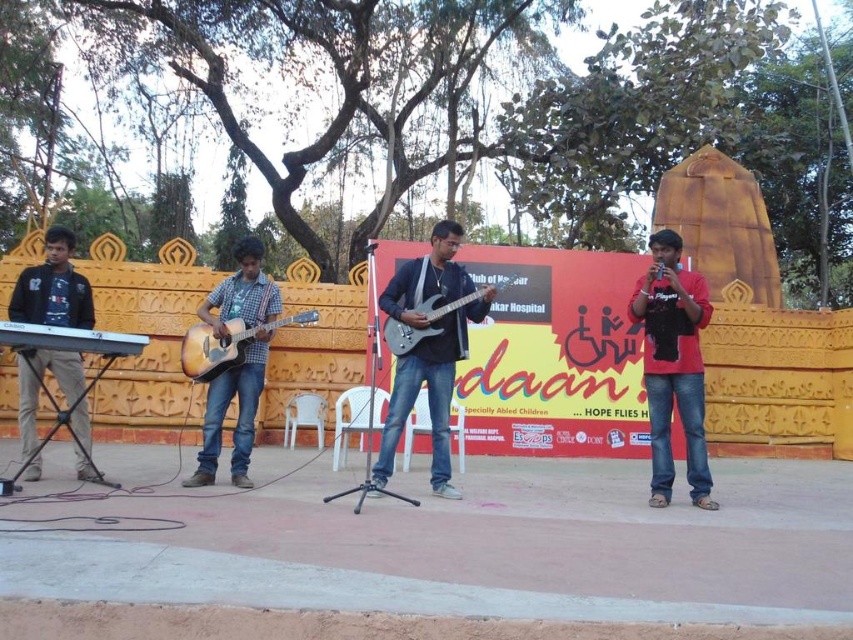
Question: Among these objects, which one is nearest to the camera?

Choices:
 (A) metallic silver guitar at center
 (B) natural wood acoustic guitar at center
 (C) red matte shirt at right

Answer: (A)

Question: Is wooden acoustic guitar at center positioned behind glossy electric guitar at center?

Choices:
 (A) yes
 (B) no

Answer: (A)

Question: Does metallic silver guitar at center have a lesser width compared to glossy electric guitar at center?

Choices:
 (A) yes
 (B) no

Answer: (B)

Question: Among these points, which one is nearest to the camera?

Choices:
 (A) (456, 300)
 (B) (444, 496)
 (C) (123, 596)
 (D) (225, 369)

Answer: (C)

Question: Is metallic silver guitar at center positioned in front of wooden acoustic guitar at center?

Choices:
 (A) yes
 (B) no

Answer: (A)

Question: Among these points, which one is farthest from the camera?

Choices:
 (A) (801, 516)
 (B) (438, 467)
 (C) (422, 259)
 (D) (53, 272)

Answer: (C)